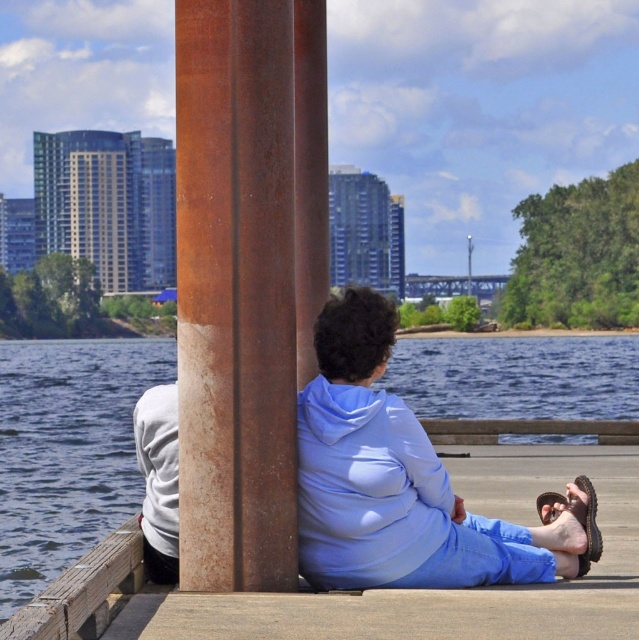
Consider the image. Is rusty metal pole at left closer to camera compared to white matte hoodie at lower left?

Yes, rusty metal pole at left is in front of white matte hoodie at lower left.

Between rusty metal pole at left and white matte hoodie at lower left, which one is positioned higher?

rusty metal pole at left

Is point (282, 28) behind point (174, 561)?

No.

The image size is (639, 640). In order to click on rusty metal pole at left in this screenshot , I will do `click(235, 294)`.

Describe the element at coordinates (66, 449) in the screenshot. I see `blue water at center` at that location.

Consider the image. How much distance is there between blue water at center and white matte hoodie at lower left?

They are 70.44 meters apart.

Is point (516, 381) positioned after point (164, 400)?

Yes, point (516, 381) is behind point (164, 400).

The width and height of the screenshot is (639, 640). Find the location of `blue water at center`. blue water at center is located at coordinates (66, 449).

Between rusty metal pole at left and blue water at center, which one is positioned higher?

rusty metal pole at left

Is point (279, 419) positioned in front of point (518, 400)?

Yes, it is.

Is point (208, 440) farther from camera compared to point (19, 554)?

No, it is in front of (19, 554).

I want to click on rusty metal pole at left, so click(x=235, y=294).